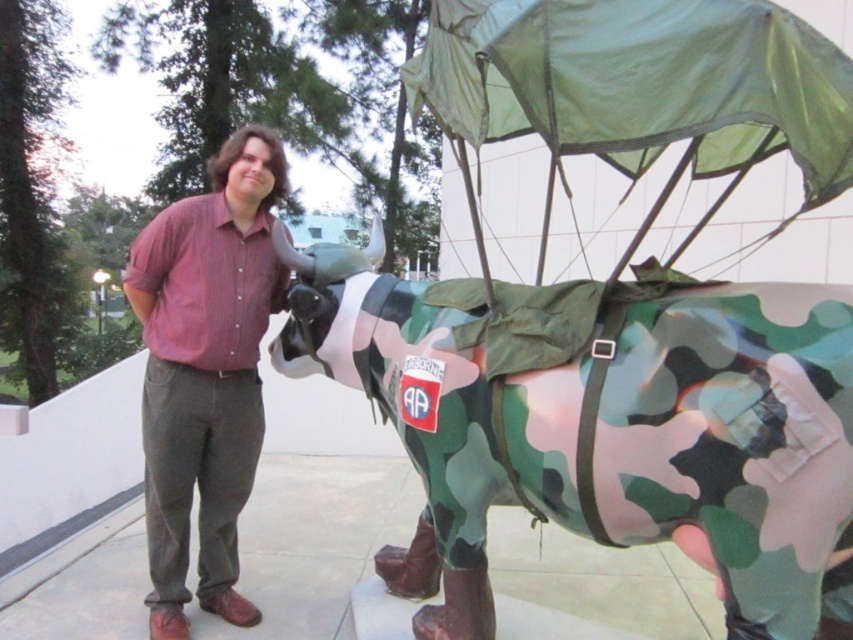
Question: Which object is farther from the camera taking this photo?

Choices:
 (A) camouflage fabric cow at right
 (B) matte red shirt at center

Answer: (B)

Question: Is camouflage fabric cow at right bigger than matte red shirt at center?

Choices:
 (A) yes
 (B) no

Answer: (A)

Question: Which of the following is the farthest from the observer?

Choices:
 (A) (590, 484)
 (B) (201, 323)

Answer: (B)

Question: In this image, where is camouflage fabric cow at right located relative to matte red shirt at center?

Choices:
 (A) left
 (B) right

Answer: (B)

Question: Which object is farther from the camera taking this photo?

Choices:
 (A) camouflage fabric cow at right
 (B) matte red shirt at center

Answer: (B)

Question: Is camouflage fabric cow at right to the right of matte red shirt at center from the viewer's perspective?

Choices:
 (A) no
 (B) yes

Answer: (B)